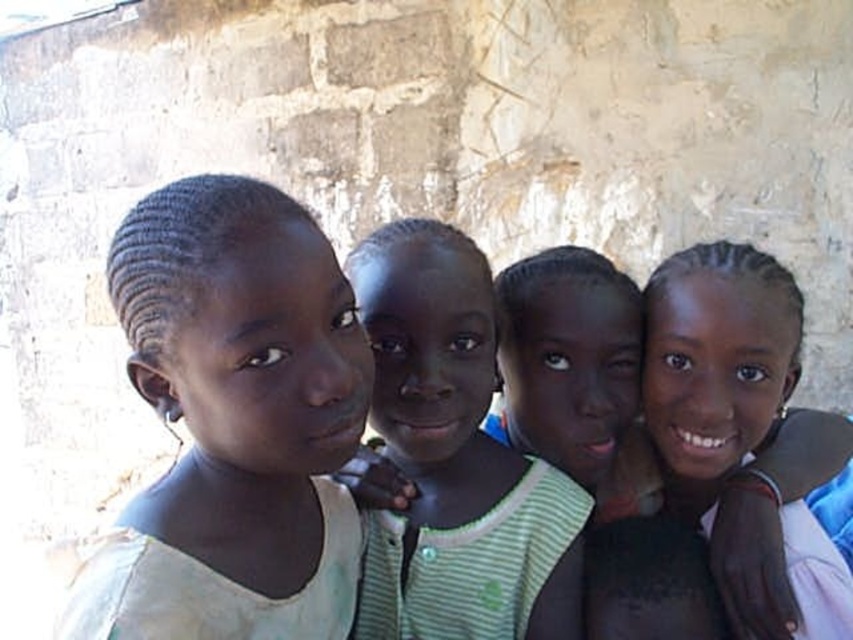
Looking at this image, you are standing in front of the stone wall and want to place a small sticker on the wall. You have two options for placement based on coordinates given in the image. The first option is at point [375,488] and the second is at point [685,259]. Which point is closer to you where you are standing?

Point [375,488] is closer to the viewer than point [685,259], so you should place the sticker there if you want it closer.

You are a photographer trying to capture the girls in the scene. You notice the light beige fabric at center and the green striped shirt at center. Which one should you focus on if you want to highlight the area that is higher up in the image?

The light beige fabric at center is located above the green striped shirt at center, so focusing on it will highlight the higher area.